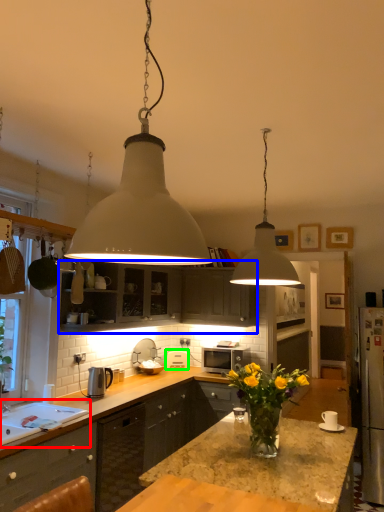
Question: Estimate the real-world distances between objects in this image. Which object is closer to sink (highlighted by a red box), cabinetry (highlighted by a blue box) or appliance (highlighted by a green box)?

Choices:
 (A) cabinetry
 (B) appliance

Answer: (A)